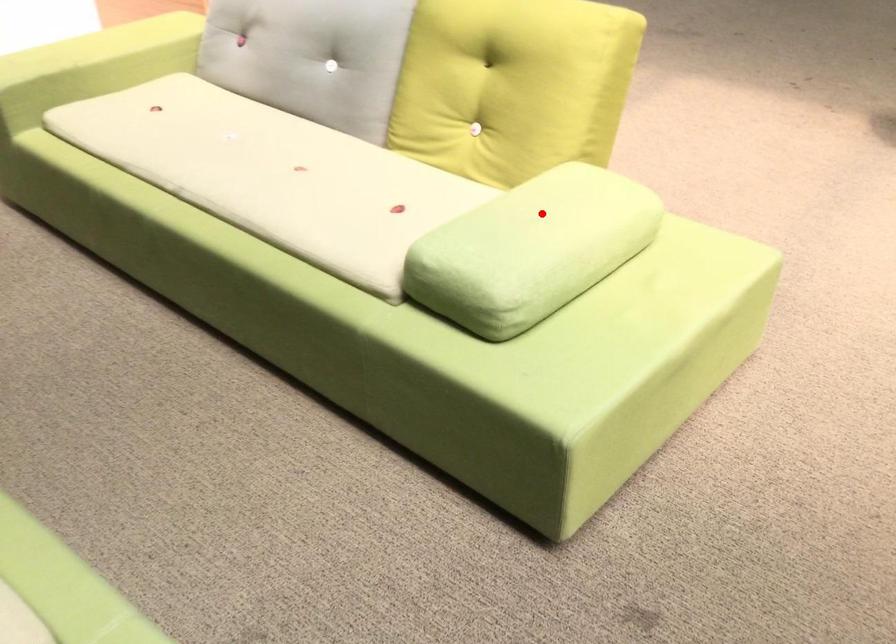
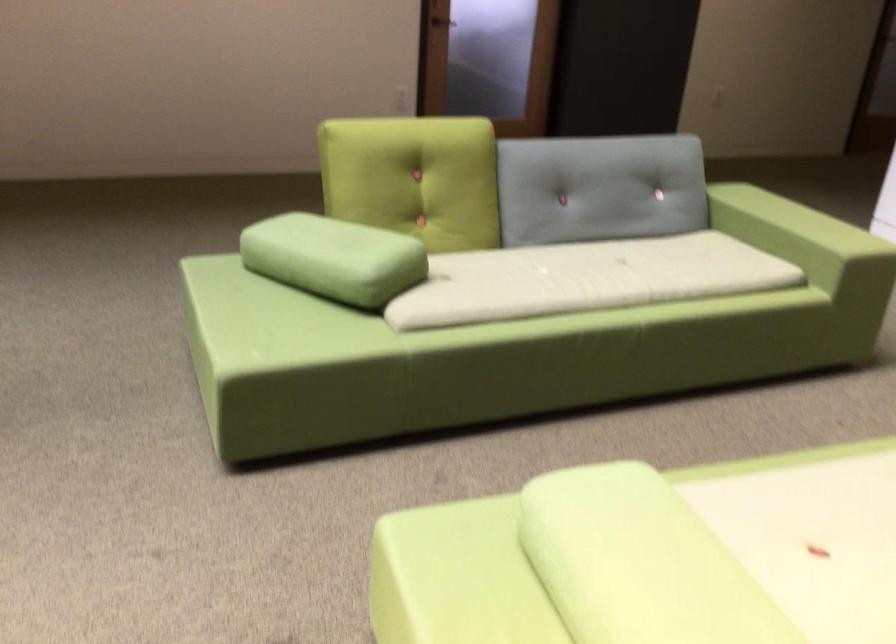
Question: I am providing you with two images of the same scene from different viewpoints. Image1 has a red point marked. In image2, the corresponding 3D location appears at what relative position? Reply with the corresponding letter.

Choices:
 (A) Closer
 (B) Farther

Answer: (A)